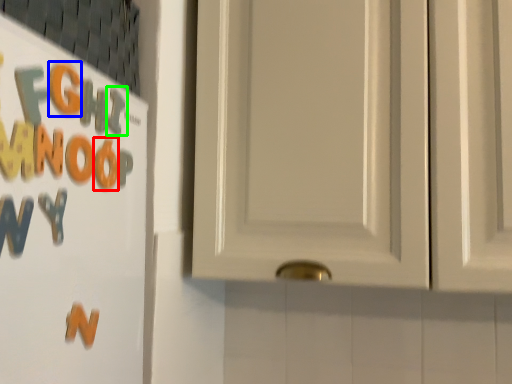
Question: Which object is the closest to the letter (highlighted by a red box)? Choose among these: letter (highlighted by a blue box) or letter (highlighted by a green box).

Choices:
 (A) letter
 (B) letter

Answer: (B)